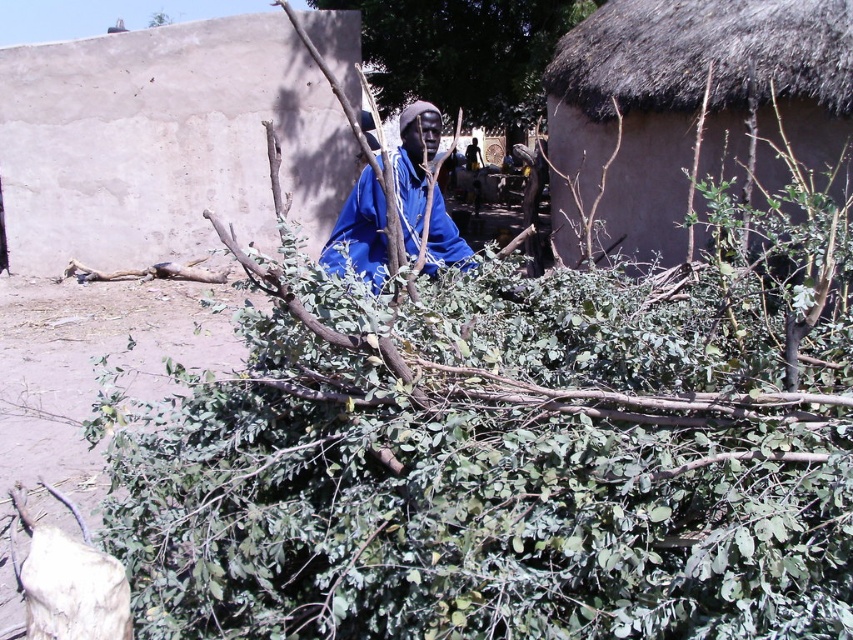
Question: Which point appears closest to the camera in this image?

Choices:
 (A) (410, 227)
 (B) (416, 58)

Answer: (A)

Question: Is green leafy bush at center positioned behind blue matte robe at center?

Choices:
 (A) yes
 (B) no

Answer: (A)

Question: Does green leafy bush at center appear under blue matte robe at center?

Choices:
 (A) yes
 (B) no

Answer: (B)

Question: Is the position of green leafy bush at center less distant than that of blue matte robe at center?

Choices:
 (A) no
 (B) yes

Answer: (A)